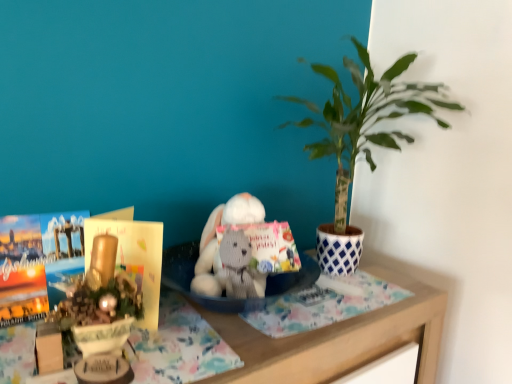
Question: From the image's perspective, would you say gray knitted stuffed animal at center is shown under green leafy plant at upper right?

Choices:
 (A) no
 (B) yes

Answer: (B)

Question: Is gray knitted stuffed animal at center with green leafy plant at upper right?

Choices:
 (A) yes
 (B) no

Answer: (B)

Question: Could you tell me if gray knitted stuffed animal at center is facing green leafy plant at upper right?

Choices:
 (A) yes
 (B) no

Answer: (B)

Question: Is gray knitted stuffed animal at center oriented away from green leafy plant at upper right?

Choices:
 (A) no
 (B) yes

Answer: (A)

Question: Is gray knitted stuffed animal at center smaller than green leafy plant at upper right?

Choices:
 (A) yes
 (B) no

Answer: (A)

Question: Is gray knitted stuffed animal at center further to the viewer compared to green leafy plant at upper right?

Choices:
 (A) yes
 (B) no

Answer: (B)

Question: Can we say matte paper book at left lies outside wooden table at center?

Choices:
 (A) no
 (B) yes

Answer: (B)

Question: Does matte paper book at left turn towards wooden table at center?

Choices:
 (A) yes
 (B) no

Answer: (B)

Question: Is matte paper book at left to the right of wooden table at center from the viewer's perspective?

Choices:
 (A) no
 (B) yes

Answer: (A)

Question: Can you confirm if matte paper book at left is taller than wooden table at center?

Choices:
 (A) yes
 (B) no

Answer: (B)

Question: Is matte paper book at left surrounding wooden table at center?

Choices:
 (A) no
 (B) yes

Answer: (A)

Question: Does matte paper book at left appear on the left side of wooden table at center?

Choices:
 (A) yes
 (B) no

Answer: (A)

Question: Is wooden table at center not close to gray knitted stuffed animal at center?

Choices:
 (A) yes
 (B) no

Answer: (B)